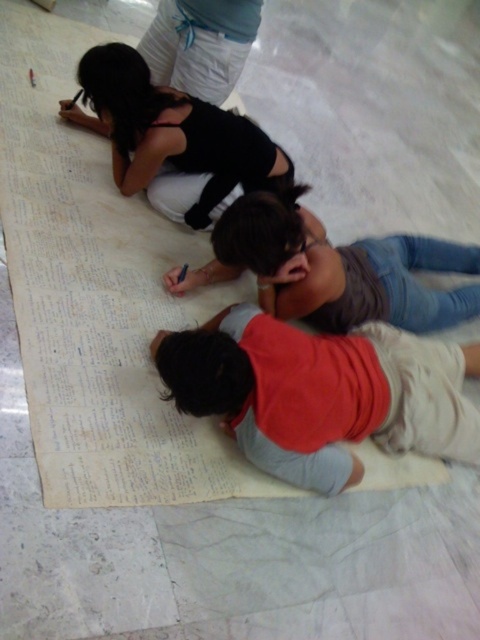
Question: Estimate the real-world distances between objects in this image. Which object is farther from the red cotton shirt at lower center?

Choices:
 (A) matte black top at upper left
 (B) matte gray shirt at center

Answer: (A)

Question: Can you confirm if red cotton shirt at lower center is positioned below matte gray shirt at center?

Choices:
 (A) no
 (B) yes

Answer: (B)

Question: Does red cotton shirt at lower center appear on the right side of matte black top at upper left?

Choices:
 (A) yes
 (B) no

Answer: (A)

Question: Which point is farther to the camera?

Choices:
 (A) matte gray shirt at center
 (B) matte black top at upper left
 (C) red cotton shirt at lower center

Answer: (B)

Question: Based on their relative distances, which object is farther from the matte black top at upper left?

Choices:
 (A) matte gray shirt at center
 (B) red cotton shirt at lower center

Answer: (B)

Question: Does red cotton shirt at lower center have a smaller size compared to matte black top at upper left?

Choices:
 (A) no
 (B) yes

Answer: (A)